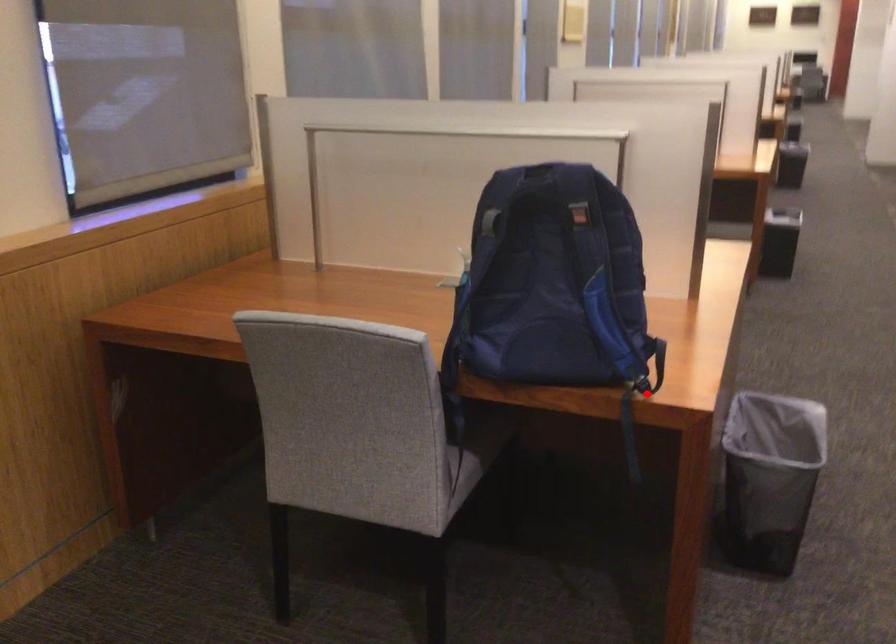
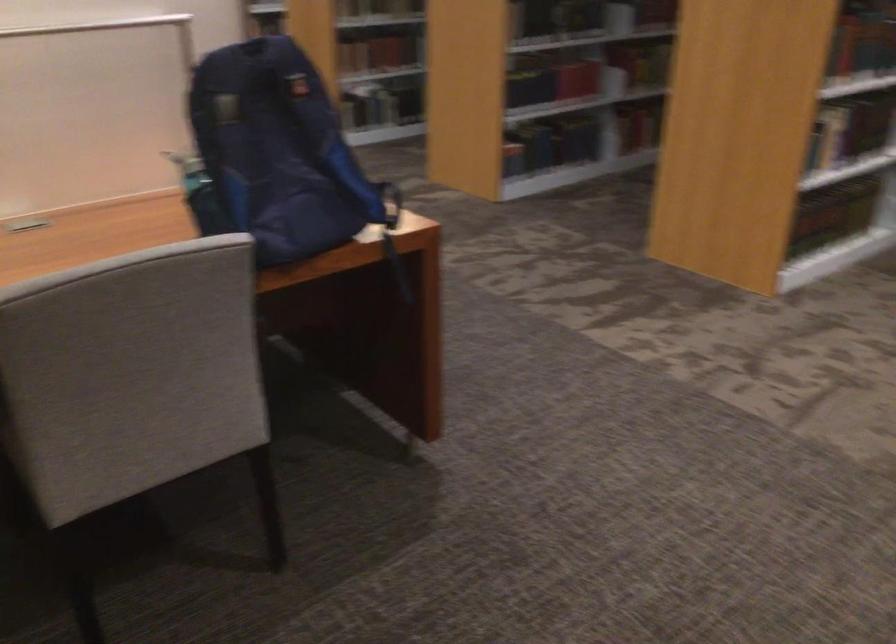
Where in the second image is the point corresponding to the highlighted location from the first image?

(392, 234)